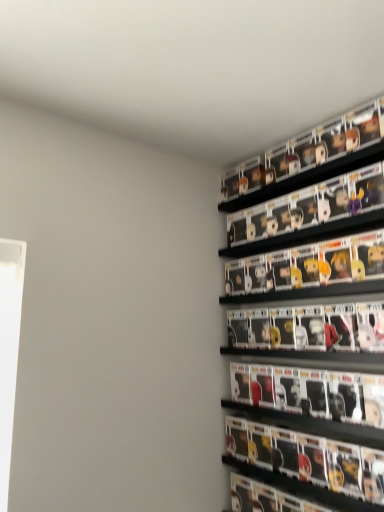
In order to face matte black figure at right, should I rotate leftwards or rightwards?

You should rotate right by 14.061 degrees.

The image size is (384, 512). In order to click on black plastic shelf at upper right, positioned as the 2th shelf in bottom-to-top order in this screenshot , I will do `click(316, 155)`.

From a real-world perspective, who is located higher, matt black figurines at upper right, positioned as the second shelf in top-to-bottom order, or matte black figure at right?

From a 3D spatial view, matt black figurines at upper right, positioned as the second shelf in top-to-bottom order, is above.

Does point (256, 212) lie in front of point (226, 425)?

No, (256, 212) is behind (226, 425).

This screenshot has width=384, height=512. In order to click on the 1st shelf behind the matte black figure at right in this screenshot , I will do `click(304, 212)`.

Looking at this image, is there a large distance between matt black figurines at upper right, positioned as the second shelf in top-to-bottom order, and matte black figure at right?

No, matt black figurines at upper right, positioned as the second shelf in top-to-bottom order, is not far from matte black figure at right.

Between matt black figurines at upper right, positioned as the second shelf in top-to-bottom order, and black plastic shelf at upper right, positioned as the first shelf in top-to-bottom order, which one has smaller size?

matt black figurines at upper right, positioned as the second shelf in top-to-bottom order.

The height and width of the screenshot is (512, 384). I want to click on shelf lying above the matt black figurines at upper right, the first shelf in the bottom-to-top sequence (from the image's perspective), so click(x=316, y=155).

From the image's perspective, which object appears higher, matt black figurines at upper right, the first shelf in the bottom-to-top sequence, or black plastic shelf at upper right, positioned as the 2th shelf in bottom-to-top order?

black plastic shelf at upper right, positioned as the 2th shelf in bottom-to-top order, appears higher in the image.

Between point (299, 195) and point (311, 170), which one is positioned behind?

The point (299, 195) is behind.

How many degrees apart are the facing directions of matte black figure at right and black plastic shelf at upper right, positioned as the 2th shelf in bottom-to-top order?

4.87e-05 degrees separate the facing orientations of matte black figure at right and black plastic shelf at upper right, positioned as the 2th shelf in bottom-to-top order.

I want to click on the 2nd shelf counting from the right side of the matte black figure at right, so click(x=316, y=155).

From a real-world perspective, does matte black figure at right stand above black plastic shelf at upper right, positioned as the first shelf in top-to-bottom order?

No.

Is matte black figure at right to the right of black plastic shelf at upper right, positioned as the first shelf in top-to-bottom order, from the viewer's perspective?

No, matte black figure at right is not to the right of black plastic shelf at upper right, positioned as the first shelf in top-to-bottom order.

Find the location of a particular element. The image size is (384, 512). shelf that is the 1st object located behind the matte black figure at right is located at coordinates (304, 212).

From a real-world perspective, is matte black figure at right on top of matt black figurines at upper right, the first shelf in the bottom-to-top sequence?

Actually, matte black figure at right is physically below matt black figurines at upper right, the first shelf in the bottom-to-top sequence, in the real world.

Considering the positions of objects matte black figure at right and matt black figurines at upper right, positioned as the second shelf in top-to-bottom order, in the image provided, who is more to the right, matte black figure at right or matt black figurines at upper right, positioned as the second shelf in top-to-bottom order,?

Positioned to the right is matt black figurines at upper right, positioned as the second shelf in top-to-bottom order.

From a real-world perspective, is black plastic shelf at upper right, positioned as the 2th shelf in bottom-to-top order, positioned above or below matte black figure at right?

black plastic shelf at upper right, positioned as the 2th shelf in bottom-to-top order, is situated higher than matte black figure at right in the real world.

Can you tell me how much black plastic shelf at upper right, positioned as the first shelf in top-to-bottom order, and matte black figure at right differ in facing direction?

They differ by 4.87e-05 degrees in their facing directions.

Based on the photo, considering the relative sizes of black plastic shelf at upper right, positioned as the first shelf in top-to-bottom order, and matte black figure at right in the image provided, is black plastic shelf at upper right, positioned as the first shelf in top-to-bottom order, taller than matte black figure at right?

No.

Based on their sizes in the image, would you say black plastic shelf at upper right, positioned as the 2th shelf in bottom-to-top order, is bigger or smaller than matte black figure at right?

Considering their sizes, black plastic shelf at upper right, positioned as the 2th shelf in bottom-to-top order, takes up less space than matte black figure at right.

Who is shorter, black plastic shelf at upper right, positioned as the 2th shelf in bottom-to-top order, or matt black figurines at upper right, the first shelf in the bottom-to-top sequence?

Standing shorter between the two is matt black figurines at upper right, the first shelf in the bottom-to-top sequence.

Can you tell me how much black plastic shelf at upper right, positioned as the 2th shelf in bottom-to-top order, and matt black figurines at upper right, the first shelf in the bottom-to-top sequence, differ in facing direction?

The facing directions of black plastic shelf at upper right, positioned as the 2th shelf in bottom-to-top order, and matt black figurines at upper right, the first shelf in the bottom-to-top sequence, are 7.48e-05 degrees apart.

From a real-world perspective, relative to matt black figurines at upper right, positioned as the second shelf in top-to-bottom order, is black plastic shelf at upper right, positioned as the first shelf in top-to-bottom order, vertically above or below?

black plastic shelf at upper right, positioned as the first shelf in top-to-bottom order, is above matt black figurines at upper right, positioned as the second shelf in top-to-bottom order.

Is black plastic shelf at upper right, positioned as the first shelf in top-to-bottom order, oriented away from matt black figurines at upper right, positioned as the second shelf in top-to-bottom order?

No.

This screenshot has height=512, width=384. What are the coordinates of `magazine in front of the matt black figurines at upper right, the first shelf in the bottom-to-top sequence` in the screenshot? It's located at (307, 463).

At what (x,y) coordinates should I click in order to perform the action: click on shelf located on the left of black plastic shelf at upper right, positioned as the 2th shelf in bottom-to-top order. Please return your answer as a coordinate pair (x, y). Image resolution: width=384 pixels, height=512 pixels. Looking at the image, I should click on (304, 212).

From the image, which object appears to be farther from matte black figure at right, matt black figurines at upper right, positioned as the second shelf in top-to-bottom order, or black plastic shelf at upper right, positioned as the first shelf in top-to-bottom order?

black plastic shelf at upper right, positioned as the first shelf in top-to-bottom order, lies further to matte black figure at right than the other object.

Considering their positions, is matt black figurines at upper right, positioned as the second shelf in top-to-bottom order, positioned closer to black plastic shelf at upper right, positioned as the 2th shelf in bottom-to-top order, than matte black figure at right?

matt black figurines at upper right, positioned as the second shelf in top-to-bottom order.

Which object lies further to the anchor point black plastic shelf at upper right, positioned as the 2th shelf in bottom-to-top order, matte black figure at right or matt black figurines at upper right, positioned as the second shelf in top-to-bottom order?

Based on the image, matte black figure at right appears to be further to black plastic shelf at upper right, positioned as the 2th shelf in bottom-to-top order.

Which object lies further to the anchor point matt black figurines at upper right, positioned as the second shelf in top-to-bottom order, matte black figure at right or black plastic shelf at upper right, positioned as the first shelf in top-to-bottom order?

matte black figure at right is positioned further to the anchor matt black figurines at upper right, positioned as the second shelf in top-to-bottom order.

Which object lies further to the anchor point matte black figure at right, black plastic shelf at upper right, positioned as the 2th shelf in bottom-to-top order, or matt black figurines at upper right, positioned as the second shelf in top-to-bottom order?

Among the two, black plastic shelf at upper right, positioned as the 2th shelf in bottom-to-top order, is located further to matte black figure at right.

Considering their positions, is black plastic shelf at upper right, positioned as the 2th shelf in bottom-to-top order, positioned further to matt black figurines at upper right, positioned as the second shelf in top-to-bottom order, than matte black figure at right?

Based on the image, matte black figure at right appears to be further to matt black figurines at upper right, positioned as the second shelf in top-to-bottom order.

At what (x,y) coordinates should I click in order to perform the action: click on shelf between black plastic shelf at upper right, positioned as the 2th shelf in bottom-to-top order, and matte black figure at right from top to bottom. Please return your answer as a coordinate pair (x, y). The height and width of the screenshot is (512, 384). Looking at the image, I should click on [x=304, y=212].